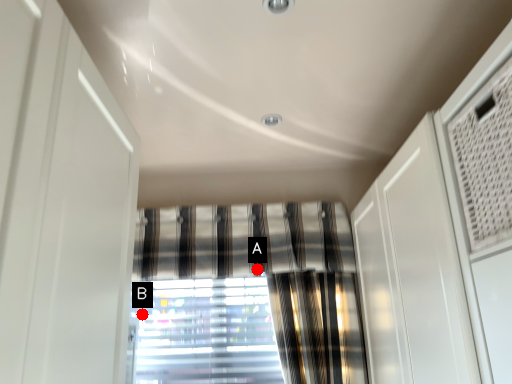
Question: Two points are circled on the image, labeled by A and B beside each circle. Which point is closer to the camera?

Choices:
 (A) A is closer
 (B) B is closer

Answer: (A)